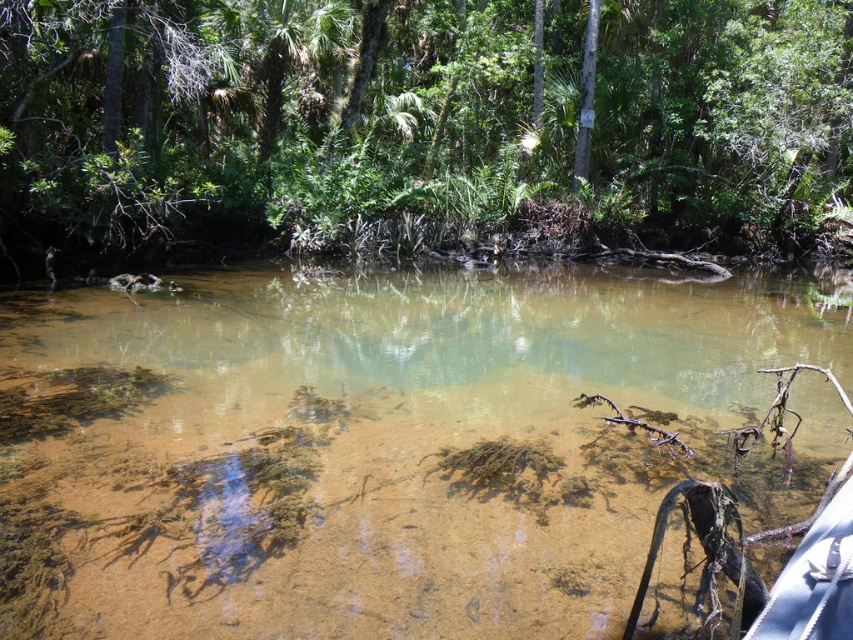
Does clear sediment river at center lie behind green leafy tree at upper center?

No.

Describe the element at coordinates (392, 444) in the screenshot. This screenshot has width=853, height=640. I see `clear sediment river at center` at that location.

Who is more forward, (338, 538) or (669, 163)?

Positioned in front is point (338, 538).

You are a GUI agent. You are given a task and a screenshot of the screen. Output one action in this format:
    pyautogui.click(x=<x>, y=<y>)
    Task: Click on the clear sediment river at center
    Image resolution: width=853 pixels, height=640 pixels.
    Given the screenshot: What is the action you would take?
    pyautogui.click(x=392, y=444)